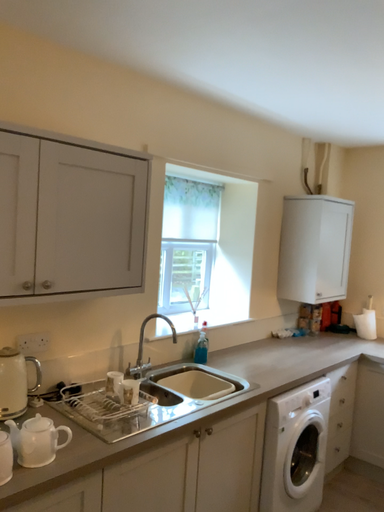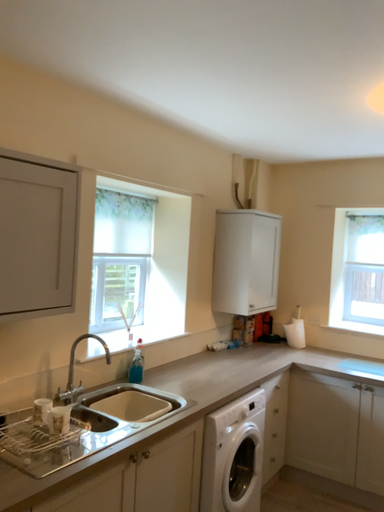
Question: Which way did the camera rotate in the video?

Choices:
 (A) rotated right
 (B) rotated left

Answer: (A)